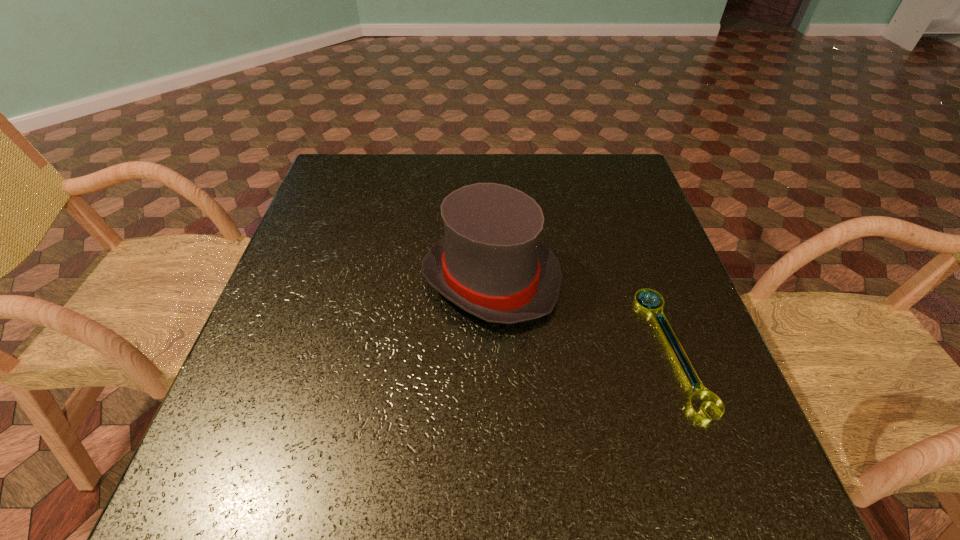
The image size is (960, 540). In order to click on free space at the right edge of the desktop in this screenshot , I will do `click(632, 316)`.

The height and width of the screenshot is (540, 960). What are the coordinates of `vacant area at the far left corner of the desktop` in the screenshot? It's located at (366, 154).

Find the location of `free space at the near right corner of the desktop`. free space at the near right corner of the desktop is located at coordinates (745, 457).

The width and height of the screenshot is (960, 540). What are the coordinates of `vacant space that satisfies the following two spatial constraints: 1. on the front side of the taller object; 2. on the left side of the shorter object` in the screenshot? It's located at (492, 349).

At what (x,y) coordinates should I click in order to perform the action: click on vacant point that satisfies the following two spatial constraints: 1. on the front side of the shorter object; 2. on the left side of the taller object. Please return your answer as a coordinate pair (x, y). The width and height of the screenshot is (960, 540). Looking at the image, I should click on (492, 349).

Locate an element on the screen. This screenshot has height=540, width=960. free space that satisfies the following two spatial constraints: 1. on the front side of the right object; 2. on the left side of the left object is located at coordinates (492, 349).